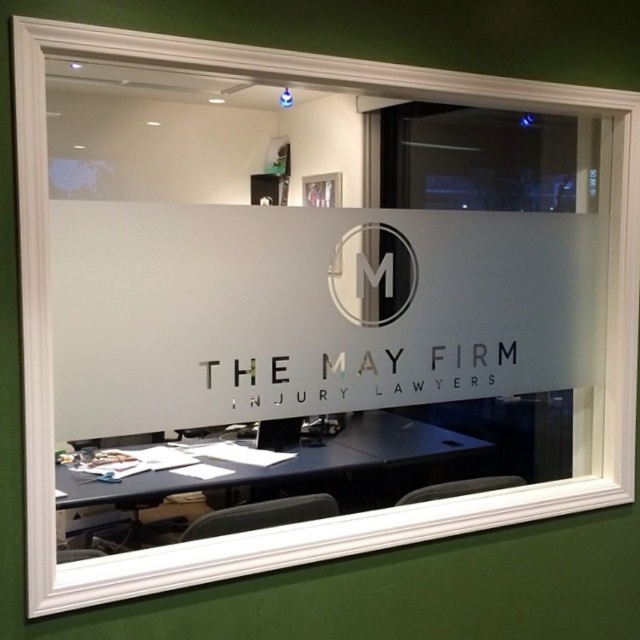
Question: Which point appears closest to the camera in this image?

Choices:
 (A) (392, 241)
 (B) (272, 472)

Answer: (A)

Question: Is black glossy table at lower center further to camera compared to satin black circle at center?

Choices:
 (A) no
 (B) yes

Answer: (B)

Question: Is black glossy table at lower center below satin black circle at center?

Choices:
 (A) no
 (B) yes

Answer: (B)

Question: Which object appears closest to the camera in this image?

Choices:
 (A) satin black circle at center
 (B) black glossy table at lower center

Answer: (A)

Question: Which of the following is the farthest from the observer?

Choices:
 (A) (216, 468)
 (B) (344, 305)

Answer: (A)

Question: Is black glossy table at lower center positioned behind satin black circle at center?

Choices:
 (A) no
 (B) yes

Answer: (B)